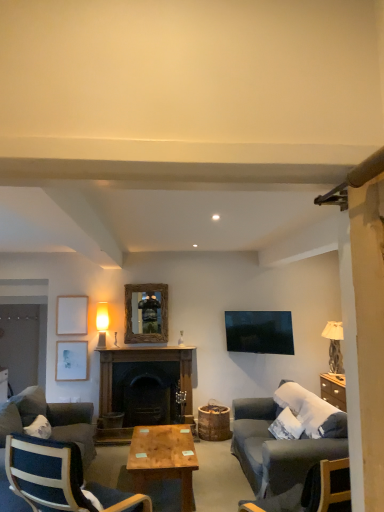
Question: Is wooden mirror at center, which is the first picture frame from right to left, positioned before dark gray fabric couch at lower left, which is the 1th studio couch from left to right?

Choices:
 (A) yes
 (B) no

Answer: (B)

Question: From a real-world perspective, is wooden mirror at center, the third picture frame when ordered from left to right, below dark gray fabric couch at lower left, placed as the second studio couch when sorted from right to left?

Choices:
 (A) no
 (B) yes

Answer: (A)

Question: From the image's perspective, is wooden mirror at center, the third picture frame when ordered from left to right, on dark gray fabric couch at lower left, which is the 1th studio couch from left to right?

Choices:
 (A) yes
 (B) no

Answer: (A)

Question: Is wooden mirror at center, which is the first picture frame from right to left, aimed at dark gray fabric couch at lower left, which is the 1th studio couch from left to right?

Choices:
 (A) yes
 (B) no

Answer: (B)

Question: Does wooden mirror at center, which is the first picture frame from right to left, have a lesser width compared to dark gray fabric couch at lower left, placed as the second studio couch when sorted from right to left?

Choices:
 (A) yes
 (B) no

Answer: (A)

Question: Considering the relative sizes of wooden mirror at center, the third picture frame when ordered from left to right, and dark gray fabric couch at lower left, placed as the second studio couch when sorted from right to left, in the image provided, is wooden mirror at center, the third picture frame when ordered from left to right, shorter than dark gray fabric couch at lower left, placed as the second studio couch when sorted from right to left,?

Choices:
 (A) yes
 (B) no

Answer: (A)

Question: Considering the relative sizes of dark blue fabric chair at lower left and wooden polished coffee table at center in the image provided, is dark blue fabric chair at lower left taller than wooden polished coffee table at center?

Choices:
 (A) yes
 (B) no

Answer: (A)

Question: Can wooden polished coffee table at center be found inside dark blue fabric chair at lower left?

Choices:
 (A) no
 (B) yes

Answer: (A)

Question: Is dark blue fabric chair at lower left turned away from wooden polished coffee table at center?

Choices:
 (A) yes
 (B) no

Answer: (B)

Question: Does dark blue fabric chair at lower left lie in front of wooden polished coffee table at center?

Choices:
 (A) yes
 (B) no

Answer: (A)

Question: From the image's perspective, is dark blue fabric chair at lower left beneath wooden polished coffee table at center?

Choices:
 (A) yes
 (B) no

Answer: (B)

Question: From a real-world perspective, is dark blue fabric chair at lower left located beneath wooden polished coffee table at center?

Choices:
 (A) yes
 (B) no

Answer: (B)

Question: Does wooden mirror at center, which is the first picture frame from right to left, have a lesser width compared to dark wood fireplace at center?

Choices:
 (A) no
 (B) yes

Answer: (B)